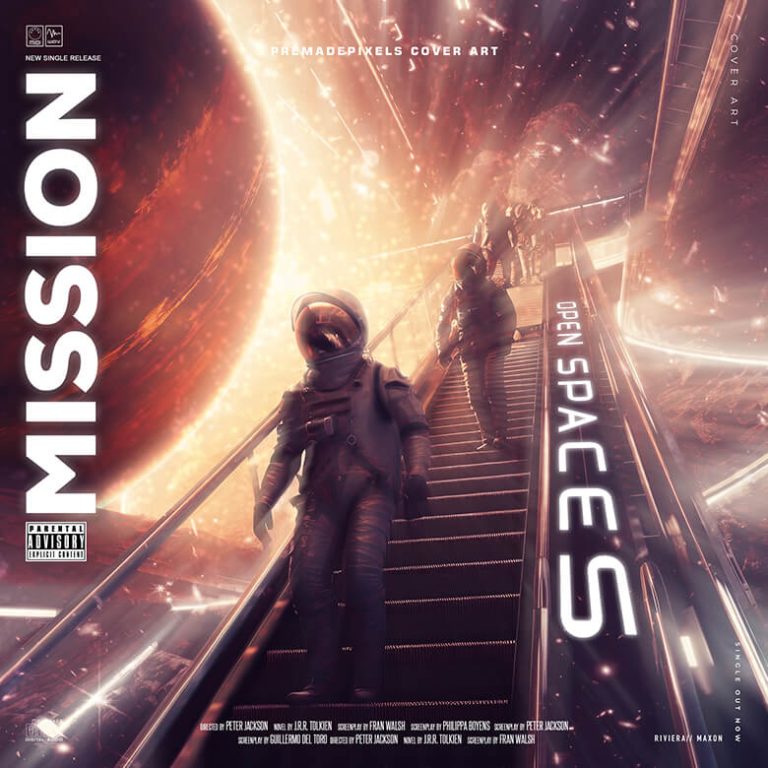
The width and height of the screenshot is (768, 768). I want to click on glass, so click(x=96, y=644).